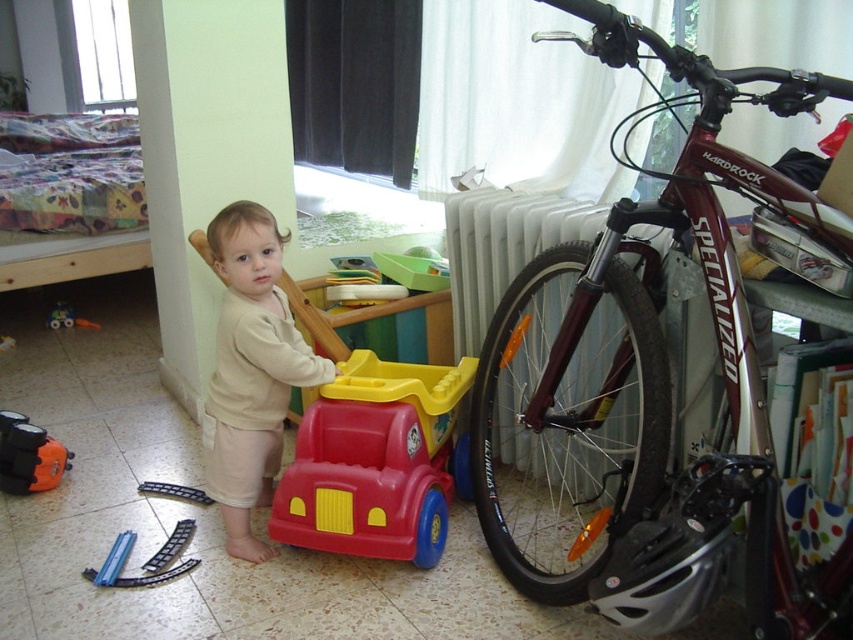
You are a parent wanting to ensure your child can safely reach the rubberized plastic toy car at center while standing on a tiled floor. Given that the child is 1.2 meters away from you, can the child safely reach the toy without needing to move closer?

The rubberized plastic toy car at center is 1.71 meters from the viewer. Since the child is 1.2 meters away from you, the total distance between the child and the toy is 1.71 meters minus 1.2 meters, which equals 0.51 meters. This means the child is still 0.51 meters away from the toy and would need to move closer to reach it safely.

You are a parent who wants to place a new bookshelf in the room. The shiny metallic bicycle at right and the blue plastic toy car at lower left are in the way. Which object should you move first to make space?

The shiny metallic bicycle at right is positioned under blue plastic toy car at lower left. To make space, you should move the blue plastic toy car at lower left first, as it is above the bicycle and moving it would allow access to the bicycle beneath.

You are a parent trying to choose a toy car for your child. You see the rubberized plastic toy car at center and the blue plastic toy car at lower left. Which one is bigger?

The rubberized plastic toy car at center is larger in size compared to the blue plastic toy car at lower left.